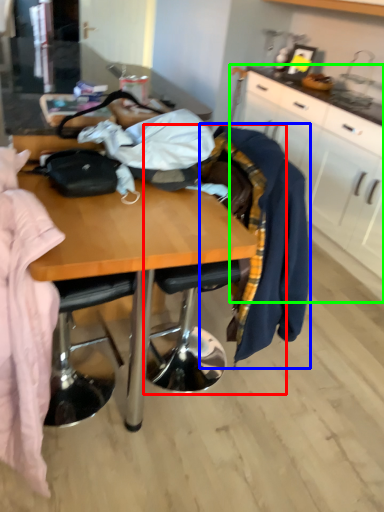
Question: Considering the real-world distances, which object is farthest from chair (highlighted by a red box)? clothing (highlighted by a blue box) or cabinetry (highlighted by a green box)?

Choices:
 (A) clothing
 (B) cabinetry

Answer: (B)